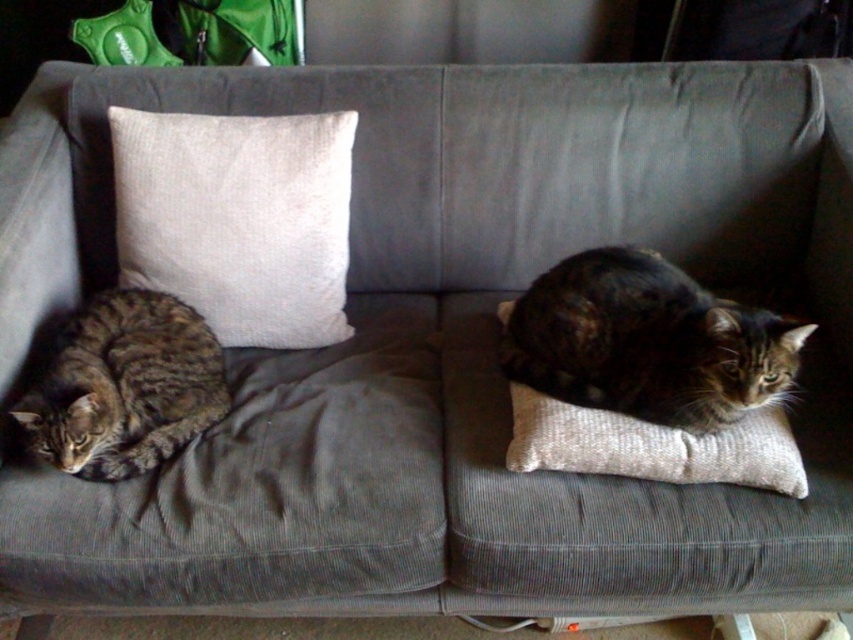
Can you confirm if white textured pillow at upper left is shorter than tabby fur cat at left?

No.

In order to click on white textured pillow at upper left in this screenshot , I will do `click(238, 220)`.

Who is lower down, tabby fur cat at center or tabby fur cat at left?

tabby fur cat at left

Can you confirm if tabby fur cat at center is smaller than tabby fur cat at left?

Actually, tabby fur cat at center might be larger than tabby fur cat at left.

Who is more distant from viewer, [746,387] or [88,362]?

The point [88,362] is more distant.

Find the location of a particular element. tabby fur cat at center is located at coordinates (646, 340).

Can you confirm if white textured pillow at upper left is positioned above tabby fur cat at center?

Indeed, white textured pillow at upper left is positioned over tabby fur cat at center.

Is point (315, 205) positioned in front of point (672, 410)?

That is False.

Image resolution: width=853 pixels, height=640 pixels. Identify the location of white textured pillow at upper left. (238, 220).